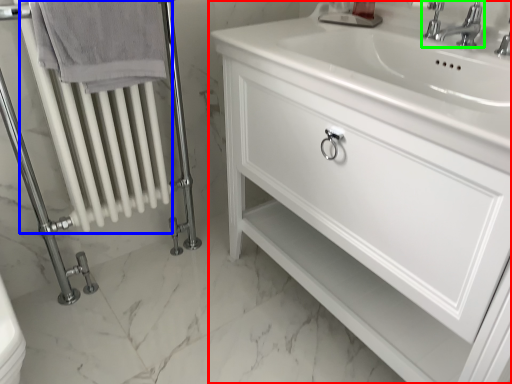
Question: Which object is the closest to the bathroom cabinet (highlighted by a red box)? Choose among these: radiator (highlighted by a blue box) or tap (highlighted by a green box).

Choices:
 (A) radiator
 (B) tap

Answer: (B)